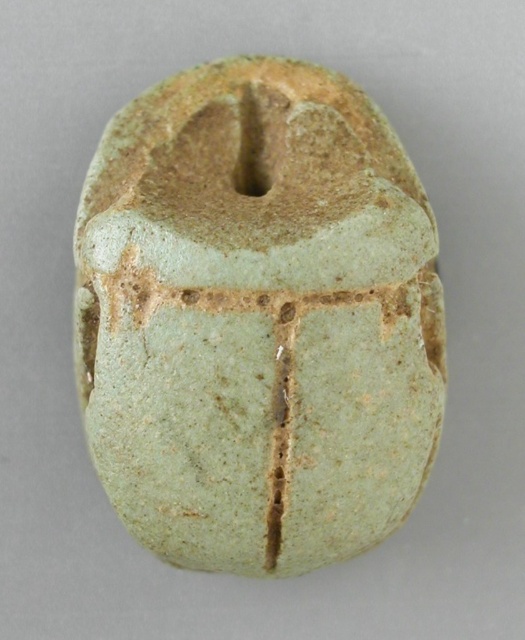
Question: Which point is closer to the camera taking this photo?

Choices:
 (A) (265, 120)
 (B) (276, 516)

Answer: (B)

Question: Where is green stone scarab at center located in relation to green cracked scarab at center in the image?

Choices:
 (A) left
 (B) right

Answer: (A)

Question: Is green stone scarab at center to the left of green cracked scarab at center from the viewer's perspective?

Choices:
 (A) no
 (B) yes

Answer: (B)

Question: Can you confirm if green stone scarab at center is positioned above green cracked scarab at center?

Choices:
 (A) no
 (B) yes

Answer: (B)